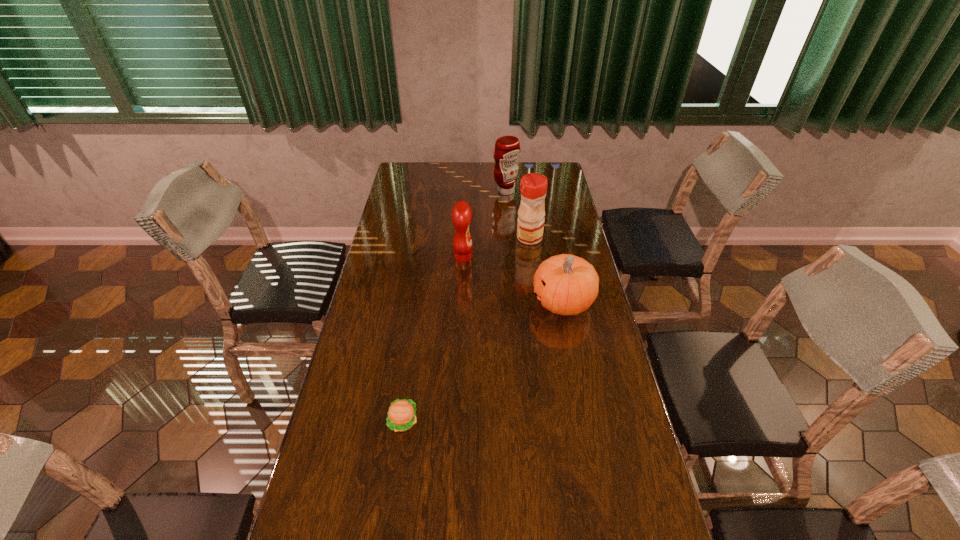
The image size is (960, 540). What are the coordinates of `vacant space at the right edge of the desktop` in the screenshot? It's located at (547, 201).

The width and height of the screenshot is (960, 540). Find the location of `blank region between the fourth farthest object and the fourth object from right to left`. blank region between the fourth farthest object and the fourth object from right to left is located at coordinates (514, 280).

Locate an element on the screen. vacant area that lies between the shortest object and the second farthest object is located at coordinates (467, 329).

Where is `vacant space that's between the second nearest condiment and the second object from left to right`? The height and width of the screenshot is (540, 960). vacant space that's between the second nearest condiment and the second object from left to right is located at coordinates (496, 247).

Identify the location of free space between the leftmost object and the third farthest object. (433, 339).

The width and height of the screenshot is (960, 540). What are the coordinates of `empty space between the fourth nearest object and the second object from left to right` in the screenshot? It's located at (496, 247).

The height and width of the screenshot is (540, 960). In order to click on free spot between the farthest condiment and the nearest condiment in this screenshot , I will do `click(485, 224)`.

The image size is (960, 540). Identify the location of free space between the farthest condiment and the second nearest object. pos(535,247).

This screenshot has width=960, height=540. I want to click on free spot between the nearest object and the second nearest condiment, so click(467, 329).

At what (x,y) coordinates should I click in order to perform the action: click on object that can be found as the third closest to the second nearest condiment. Please return your answer as a coordinate pair (x, y). Looking at the image, I should click on (507, 148).